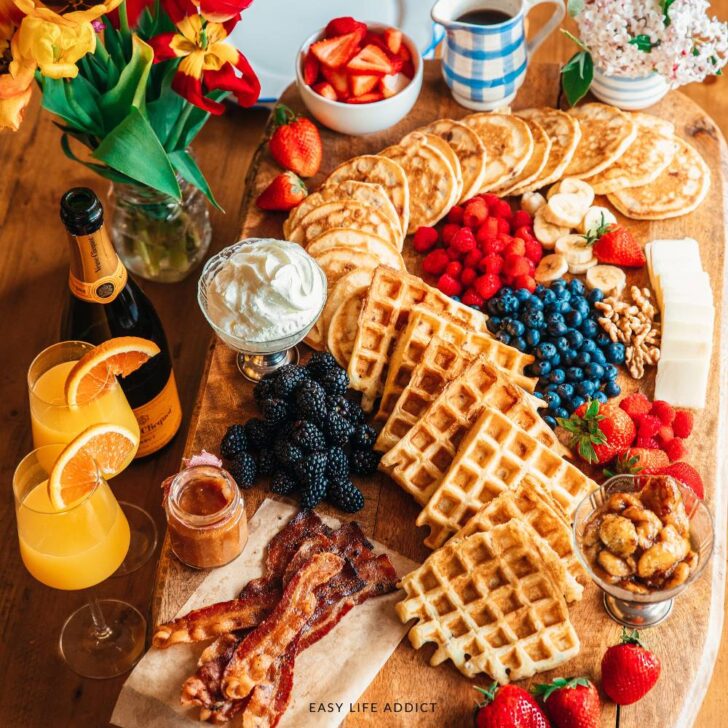
Where is `plant`? The image size is (728, 728). plant is located at coordinates (140, 145), (608, 28).